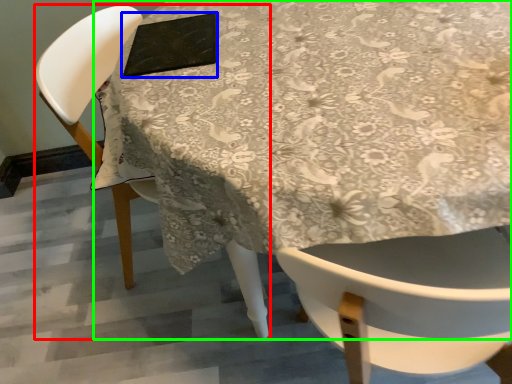
Question: Which object is the farthest from chair (highlighted by a red box)? Choose among these: pad (highlighted by a blue box) or table (highlighted by a green box).

Choices:
 (A) pad
 (B) table

Answer: (B)